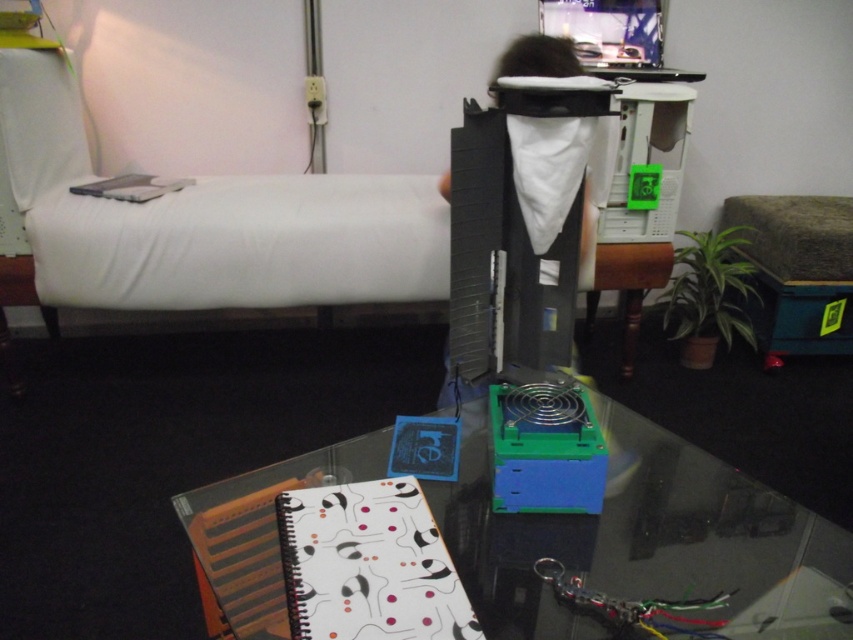
Between transparent glass table at center and matte white keyboard at left, which one is positioned higher?

matte white keyboard at left is higher up.

Does transparent glass table at center appear on the right side of matte white keyboard at left?

Correct, you'll find transparent glass table at center to the right of matte white keyboard at left.

From the picture: Who is more forward, (x=230, y=572) or (x=146, y=196)?

Positioned in front is point (x=230, y=572).

Locate an element on the screen. transparent glass table at center is located at coordinates (645, 541).